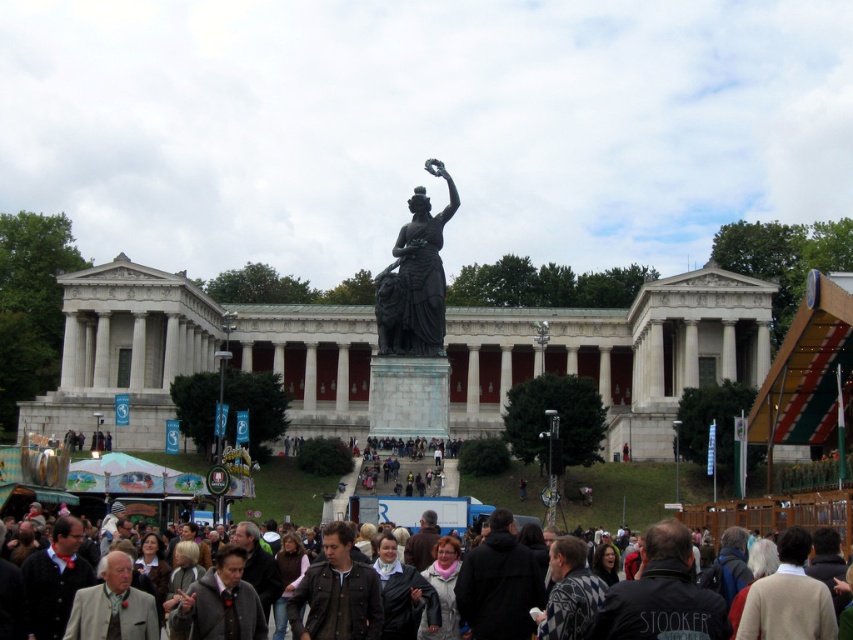
Question: Which point appears farthest from the camera in this image?

Choices:
 (A) (708, 525)
 (B) (440, 493)

Answer: (B)

Question: Which object is the closest to the dark brown leather jacket at lower center?

Choices:
 (A) dark gray fabric crowd at center
 (B) bronze statue at center

Answer: (A)

Question: Is bronze statue at center thinner than dark brown leather jacket at lower center?

Choices:
 (A) no
 (B) yes

Answer: (B)

Question: Which of the following is the farthest from the observer?

Choices:
 (A) (360, 480)
 (B) (418, 276)

Answer: (B)

Question: Considering the relative positions of bronze statue at center and dark brown leather jacket at lower center in the image provided, where is bronze statue at center located with respect to dark brown leather jacket at lower center?

Choices:
 (A) below
 (B) above

Answer: (B)

Question: Is bronze statue at center closer to the viewer compared to dark brown leather jacket at lower center?

Choices:
 (A) no
 (B) yes

Answer: (A)